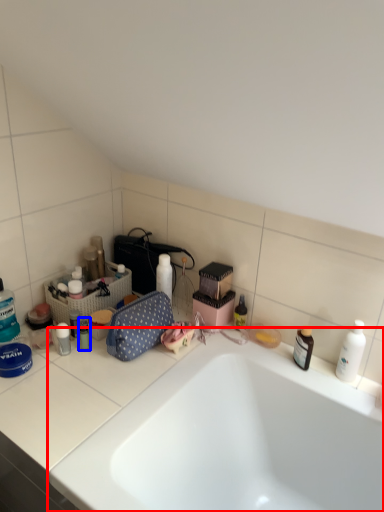
Question: Among these objects, which one is nearest to the camera, bathtub (highlighted by a red box) or toiletry (highlighted by a blue box)?

Choices:
 (A) bathtub
 (B) toiletry

Answer: (A)